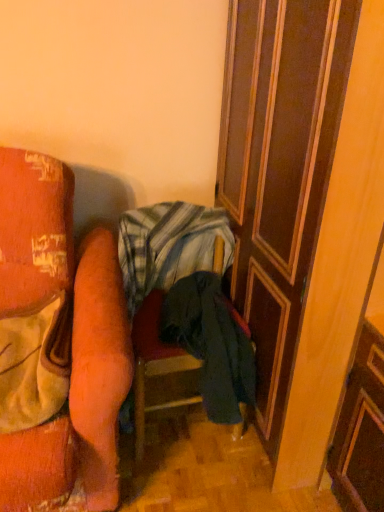
Question: From a real-world perspective, is striped cotton blanket at center physically below dark blue fabric chair at center?

Choices:
 (A) no
 (B) yes

Answer: (A)

Question: Is striped cotton blanket at center positioned beyond the bounds of dark blue fabric chair at center?

Choices:
 (A) no
 (B) yes

Answer: (A)

Question: From the image's perspective, is striped cotton blanket at center on dark blue fabric chair at center?

Choices:
 (A) no
 (B) yes

Answer: (B)

Question: Can you confirm if striped cotton blanket at center is positioned to the right of dark blue fabric chair at center?

Choices:
 (A) yes
 (B) no

Answer: (B)

Question: Can you confirm if striped cotton blanket at center is thinner than dark blue fabric chair at center?

Choices:
 (A) no
 (B) yes

Answer: (B)

Question: Considering the positions of point (195, 243) and point (230, 201), is point (195, 243) closer or farther from the camera than point (230, 201)?

Choices:
 (A) farther
 (B) closer

Answer: (A)

Question: Considering the positions of striped cotton blanket at center and wooden at right in the image, is striped cotton blanket at center wider or thinner than wooden at right?

Choices:
 (A) thin
 (B) wide

Answer: (A)

Question: Is striped cotton blanket at center bigger or smaller than wooden at right?

Choices:
 (A) big
 (B) small

Answer: (B)

Question: From the image's perspective, is striped cotton blanket at center above or below wooden at right?

Choices:
 (A) below
 (B) above

Answer: (A)

Question: Based on their positions, is dark blue fabric chair at center located to the left or right of striped cotton blanket at center?

Choices:
 (A) right
 (B) left

Answer: (A)

Question: Looking at their shapes, would you say dark blue fabric chair at center is wider or thinner than striped cotton blanket at center?

Choices:
 (A) thin
 (B) wide

Answer: (B)

Question: From their relative heights in the image, would you say dark blue fabric chair at center is taller or shorter than striped cotton blanket at center?

Choices:
 (A) short
 (B) tall

Answer: (B)

Question: Is point (158, 362) closer or farther from the camera than point (145, 247)?

Choices:
 (A) farther
 (B) closer

Answer: (B)

Question: From their relative heights in the image, would you say wooden at right is taller or shorter than dark blue fabric chair at center?

Choices:
 (A) tall
 (B) short

Answer: (A)

Question: In the image, is wooden at right positioned in front of or behind dark blue fabric chair at center?

Choices:
 (A) behind
 (B) front

Answer: (B)